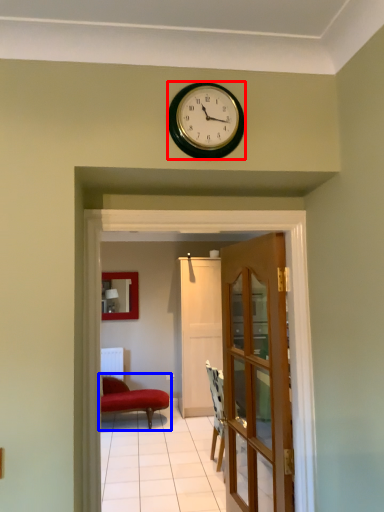
Question: Which of the following is the closest to the observer, wall clock (highlighted by a red box) or studio couch (highlighted by a blue box)?

Choices:
 (A) wall clock
 (B) studio couch

Answer: (A)